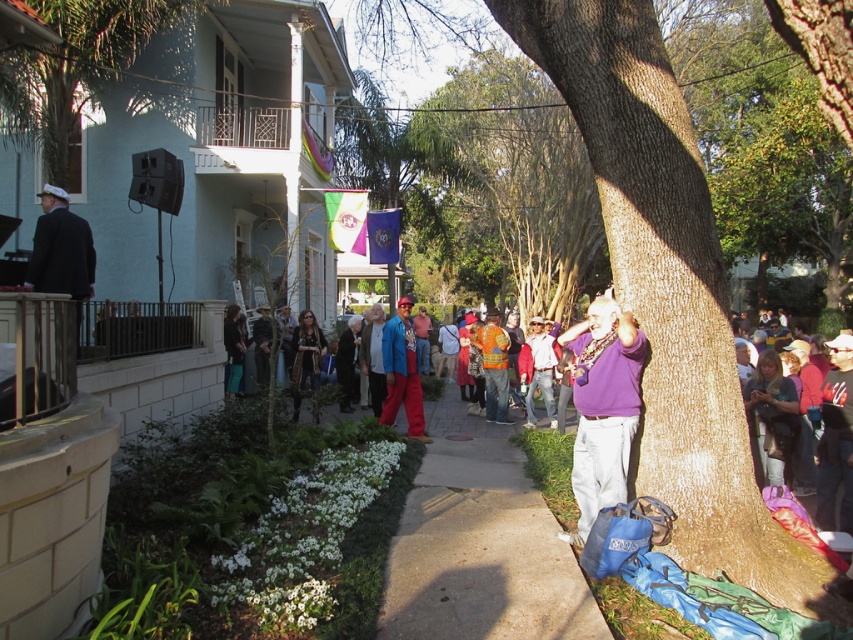
Question: Is green leafy tree at upper left to the right of purple cotton shirt at center-right from the viewer's perspective?

Choices:
 (A) no
 (B) yes

Answer: (A)

Question: Which point appears farthest from the camera in this image?

Choices:
 (A) (56, 216)
 (B) (601, 451)
 (C) (399, 344)

Answer: (C)

Question: Does green leafy tree at upper left appear under purple cotton shirt at center-right?

Choices:
 (A) no
 (B) yes

Answer: (A)

Question: Observing the image, what is the correct spatial positioning of green leafy tree at upper left in reference to purple cotton shirt at center-right?

Choices:
 (A) above
 (B) below

Answer: (A)

Question: Which of the following is the farthest from the observer?

Choices:
 (A) (587, 310)
 (B) (38, 193)

Answer: (B)

Question: Which of the following is the closest to the observer?

Choices:
 (A) purple cotton shirt at center-right
 (B) shiny blue jacket at center

Answer: (A)